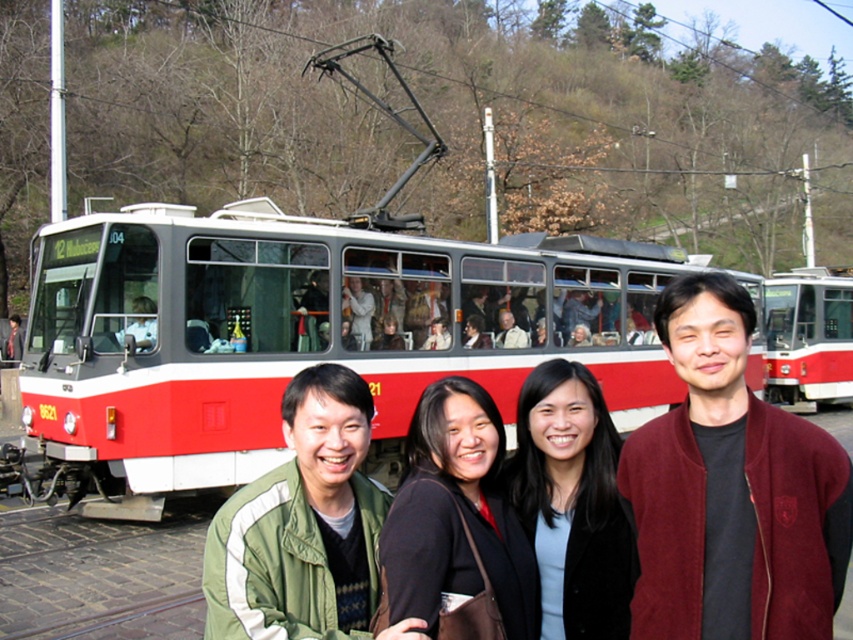
Can you confirm if green fabric jacket at center is thinner than black fabric at center?

No, green fabric jacket at center is not thinner than black fabric at center.

Between point (242, 512) and point (413, 595), which one is positioned in front?

Point (413, 595) is more forward.

Image resolution: width=853 pixels, height=640 pixels. Find the location of `green fabric jacket at center`. green fabric jacket at center is located at coordinates (305, 525).

Based on the photo, who is positioned more to the left, red/white metal tram at center or black fabric at center?

red/white metal tram at center

Can you confirm if red/white metal tram at center is shorter than black fabric at center?

In fact, red/white metal tram at center may be taller than black fabric at center.

The image size is (853, 640). I want to click on red/white metal tram at center, so click(305, 336).

Is green fabric jacket at center to the left of matte black jacket at center from the viewer's perspective?

Correct, you'll find green fabric jacket at center to the left of matte black jacket at center.

Does green fabric jacket at center have a smaller size compared to matte black jacket at center?

Actually, green fabric jacket at center might be larger than matte black jacket at center.

Image resolution: width=853 pixels, height=640 pixels. Describe the element at coordinates (305, 525) in the screenshot. I see `green fabric jacket at center` at that location.

Find the location of a particular element. green fabric jacket at center is located at coordinates (305, 525).